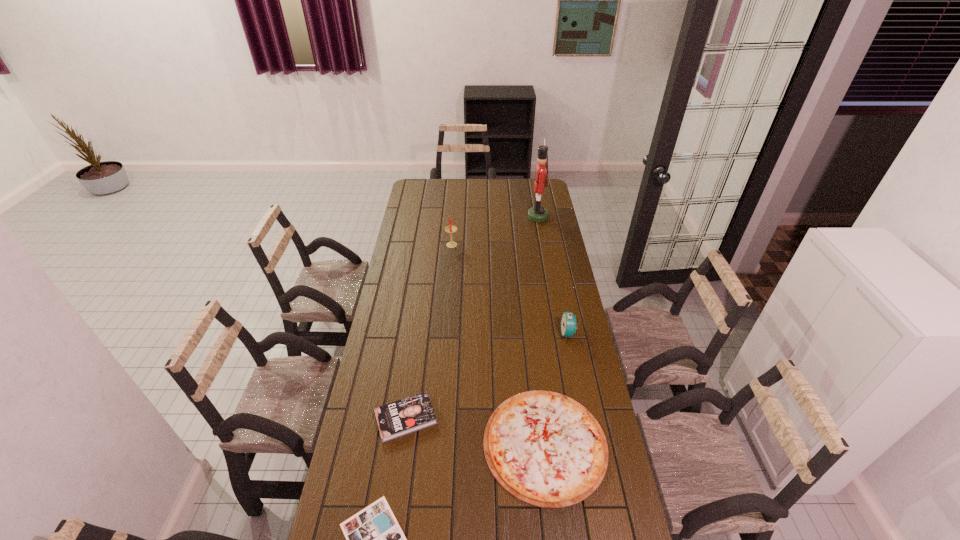
I want to click on the farthest object, so click(538, 213).

What are the coordinates of `the tallest object` in the screenshot? It's located at (538, 213).

Where is `the fifth nearest object`? The height and width of the screenshot is (540, 960). the fifth nearest object is located at coordinates (450, 229).

I want to click on the second tallest object, so click(x=450, y=229).

The height and width of the screenshot is (540, 960). Find the location of `the fourth nearest object`. the fourth nearest object is located at coordinates (568, 320).

Find the location of a particular element. alarm clock is located at coordinates (568, 320).

I want to click on the farther book, so coord(408,415).

You are a GUI agent. You are given a task and a screenshot of the screen. Output one action in this format:
    pyautogui.click(x=<x>, y=<y>)
    Task: Click on the fourth tallest object
    Image resolution: width=960 pixels, height=540 pixels.
    Given the screenshot: What is the action you would take?
    pyautogui.click(x=408, y=415)

I want to click on the fifth tallest object, so click(x=544, y=448).

Locate an element on the screen. vacant region located on the front-facing side of the nutcracker is located at coordinates (515, 217).